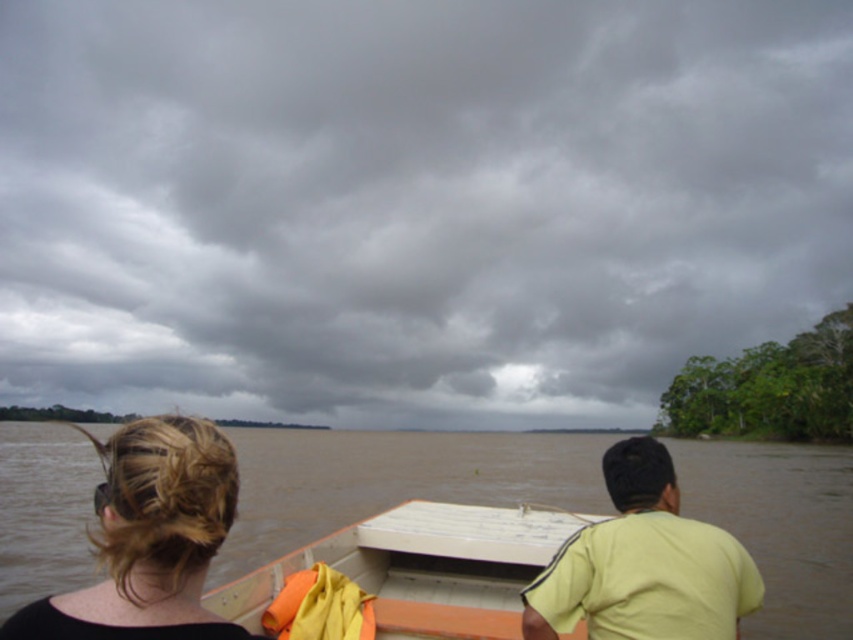
Between white matte boat at center and light green t-shirt at center, which one appears on the right side from the viewer's perspective?

light green t-shirt at center is more to the right.

Between point (561, 637) and point (624, 602), which one is positioned behind?

The point (561, 637) is more distant.

This screenshot has height=640, width=853. I want to click on white matte boat at center, so click(x=422, y=568).

Based on the photo, which is below, blonde hair at lower left or light green t-shirt at center?

light green t-shirt at center is below.

Consider the image. Does blonde hair at lower left have a greater width compared to light green t-shirt at center?

Indeed, blonde hair at lower left has a greater width compared to light green t-shirt at center.

I want to click on blonde hair at lower left, so [x=149, y=538].

Locate an element on the screen. blonde hair at lower left is located at coordinates (149, 538).

Is brown muddy water at center smaller than white matte boat at center?

No, brown muddy water at center is not smaller than white matte boat at center.

Is brown muddy water at center positioned in front of white matte boat at center?

No, brown muddy water at center is behind white matte boat at center.

Does point (485, 456) come in front of point (413, 548)?

No, (485, 456) is further to viewer.

This screenshot has width=853, height=640. Find the location of `brown muddy water at center`. brown muddy water at center is located at coordinates (392, 481).